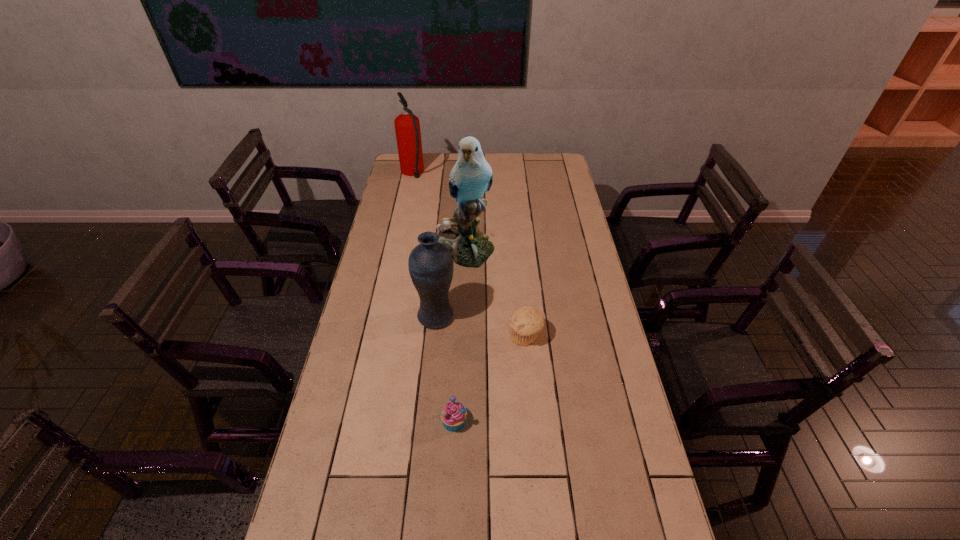
Locate an element on the screen. free spot at the right edge of the desktop is located at coordinates (556, 231).

Where is `blank space at the far left corner`? The image size is (960, 540). blank space at the far left corner is located at coordinates (425, 167).

Locate an element on the screen. Image resolution: width=960 pixels, height=540 pixels. free location at the far right corner is located at coordinates (547, 157).

The width and height of the screenshot is (960, 540). Find the location of `empty location between the nearer muffin and the taller muffin`. empty location between the nearer muffin and the taller muffin is located at coordinates click(490, 379).

Locate an element on the screen. This screenshot has height=540, width=960. free spot between the rightmost object and the vase is located at coordinates (481, 326).

The width and height of the screenshot is (960, 540). Identify the location of unoccupied position between the parakeet and the leftmost object. (439, 210).

Locate an element on the screen. The height and width of the screenshot is (540, 960). free point between the rightmost object and the fourth nearest object is located at coordinates (495, 292).

Image resolution: width=960 pixels, height=540 pixels. Find the location of `object identified as the second closest to the left muffin`. object identified as the second closest to the left muffin is located at coordinates (430, 263).

The width and height of the screenshot is (960, 540). I want to click on object that can be found as the second closest to the shortest object, so click(x=430, y=263).

At what (x,y) coordinates should I click in order to perform the action: click on vacant area in the image that satisfies the following two spatial constraints: 1. on the face of the second farthest object; 2. on the right side of the farther muffin. Please return your answer as a coordinate pair (x, y). This screenshot has height=540, width=960. Looking at the image, I should click on (461, 336).